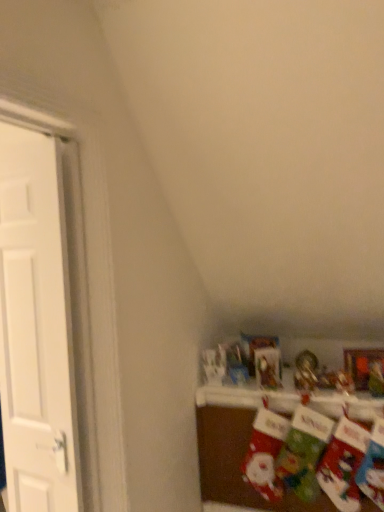
Question: Can you confirm if matte fabric stockings at lower right is smaller than white matte door at left?

Choices:
 (A) yes
 (B) no

Answer: (B)

Question: Is matte fabric stockings at lower right placed right next to white matte door at left?

Choices:
 (A) yes
 (B) no

Answer: (B)

Question: Is matte fabric stockings at lower right in front of white matte door at left?

Choices:
 (A) no
 (B) yes

Answer: (A)

Question: Considering the relative sizes of matte fabric stockings at lower right and white matte door at left in the image provided, is matte fabric stockings at lower right taller than white matte door at left?

Choices:
 (A) no
 (B) yes

Answer: (A)

Question: Is matte fabric stockings at lower right facing away from white matte door at left?

Choices:
 (A) yes
 (B) no

Answer: (B)

Question: Is matte fabric stockings at lower right to the left of white matte door at left from the viewer's perspective?

Choices:
 (A) no
 (B) yes

Answer: (A)

Question: Is white matte door at left touching matte fabric stockings at lower right?

Choices:
 (A) no
 (B) yes

Answer: (A)

Question: Would you say white matte door at left is a long distance from matte fabric stockings at lower right?

Choices:
 (A) yes
 (B) no

Answer: (A)

Question: Is matte fabric stockings at lower right at the back of white matte door at left?

Choices:
 (A) no
 (B) yes

Answer: (A)

Question: Is white matte door at left positioned before matte fabric stockings at lower right?

Choices:
 (A) no
 (B) yes

Answer: (B)

Question: Considering the relative sizes of white matte door at left and matte fabric stockings at lower right in the image provided, is white matte door at left shorter than matte fabric stockings at lower right?

Choices:
 (A) no
 (B) yes

Answer: (A)

Question: Is white matte door at left to the left of matte fabric stockings at lower right from the viewer's perspective?

Choices:
 (A) no
 (B) yes

Answer: (B)

Question: Considering the relative positions of white matte door at left and matte fabric stockings at lower right in the image provided, is white matte door at left to the left or to the right of matte fabric stockings at lower right?

Choices:
 (A) left
 (B) right

Answer: (A)